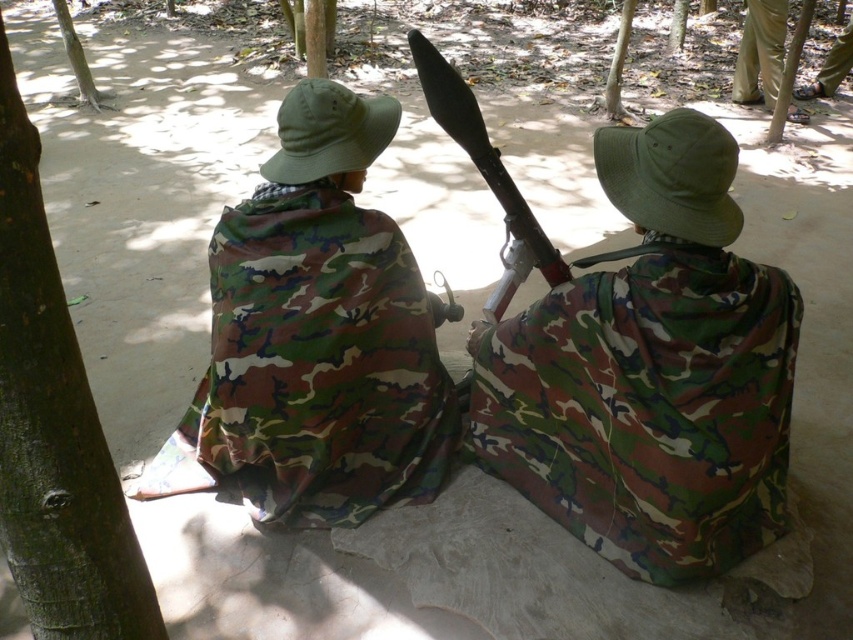
From the picture: You are a hiker who has just entered a forest and see the camouflage fabric at left and the brown bark tree at upper left. Which object is closer to your right side?

The camouflage fabric at left is closer to your right side because it is positioned to the right of the brown bark tree at upper left.

You are a scout in the forest and need to hide behind an object. Which object, the camouflage fabric at left or the smooth brown tree trunk at upper center, would be taller and thus provide better cover?

The camouflage fabric at left has a greater height compared to the smooth brown tree trunk at upper center, so it would provide better cover for hiding.

What is the exact coordinate of the matte black shotgun at center?

The matte black shotgun at center is located at coordinate point [486,176].